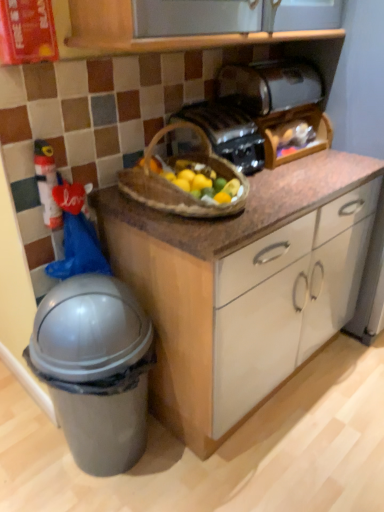
What do you see at coordinates (95, 369) in the screenshot?
I see `gray plastic trash can at lower left` at bounding box center [95, 369].

This screenshot has width=384, height=512. I want to click on gray plastic trash can at lower left, so click(x=95, y=369).

Locate an element on the screen. brown woven picnic basket at center is located at coordinates (176, 185).

Where is `gray plastic trash can at lower left`? This screenshot has width=384, height=512. gray plastic trash can at lower left is located at coordinates 95,369.

Is matte black toaster at center, the 2th toaster when ordered from top to bottom, closer to camera compared to gray plastic trash can at lower left?

Answer: No, matte black toaster at center, the 2th toaster when ordered from top to bottom, is further to the viewer.

From a real-world perspective, which object stands above the other?

matte black toaster at center, the 2th toaster when ordered from top to bottom, from a real-world perspective.

Considering the relative sizes of matte black toaster at center, the 2th toaster when ordered from top to bottom, and gray plastic trash can at lower left in the image provided, is matte black toaster at center, the 2th toaster when ordered from top to bottom, taller than gray plastic trash can at lower left?

No.

Is plastic fire extinguisher at left touching matte black toaster at center, the 1th toaster from the bottom?

No, plastic fire extinguisher at left is not making contact with matte black toaster at center, the 1th toaster from the bottom.

Relative to matte black toaster at center, the 2th toaster when ordered from top to bottom, is plastic fire extinguisher at left in front or behind?

Clearly, plastic fire extinguisher at left is in front of matte black toaster at center, the 2th toaster when ordered from top to bottom.

You are a GUI agent. You are given a task and a screenshot of the screen. Output one action in this format:
    pyautogui.click(x=<x>, y=<y>)
    Task: Click on the toy below the matte black toaster at center, the 2th toaster when ordered from top to bottom (from the image's perspective)
    The image size is (384, 512).
    Given the screenshot: What is the action you would take?
    pyautogui.click(x=47, y=183)

Is plastic fire extinguisher at left wider or thinner than matte black toaster at center, the 1th toaster from the bottom?

In the image, plastic fire extinguisher at left appears to be more narrow than matte black toaster at center, the 1th toaster from the bottom.

Can you confirm if satin black toaster at upper center, acting as the 2th toaster starting from the bottom, is taller than matte black toaster at center, the 2th toaster when ordered from top to bottom?

No.

Considering the sizes of objects satin black toaster at upper center, acting as the 2th toaster starting from the bottom, and matte black toaster at center, the 2th toaster when ordered from top to bottom, in the image provided, who is wider, satin black toaster at upper center, acting as the 2th toaster starting from the bottom, or matte black toaster at center, the 2th toaster when ordered from top to bottom,?

Wider between the two is matte black toaster at center, the 2th toaster when ordered from top to bottom.

In the image, is satin black toaster at upper center, marked as the first toaster in a top-to-bottom arrangement, positioned in front of or behind matte black toaster at center, the 2th toaster when ordered from top to bottom?

satin black toaster at upper center, marked as the first toaster in a top-to-bottom arrangement, is behind matte black toaster at center, the 2th toaster when ordered from top to bottom.

Considering the relative positions of satin black toaster at upper center, marked as the first toaster in a top-to-bottom arrangement, and matte black toaster at center, the 2th toaster when ordered from top to bottom, in the image provided, is satin black toaster at upper center, marked as the first toaster in a top-to-bottom arrangement, to the left of matte black toaster at center, the 2th toaster when ordered from top to bottom, from the viewer's perspective?

In fact, satin black toaster at upper center, marked as the first toaster in a top-to-bottom arrangement, is to the right of matte black toaster at center, the 2th toaster when ordered from top to bottom.

Is matte black toaster at center, the 2th toaster when ordered from top to bottom, taller than plastic fire extinguisher at left?

Incorrect, the height of matte black toaster at center, the 2th toaster when ordered from top to bottom, is not larger of that of plastic fire extinguisher at left.

Based on the photo, is matte black toaster at center, the 1th toaster from the bottom, touching plastic fire extinguisher at left?

There is a gap between matte black toaster at center, the 1th toaster from the bottom, and plastic fire extinguisher at left.

Is point (245, 143) in front of point (37, 165)?

No, (245, 143) is further to viewer.

Would you say matte black toaster at center, the 1th toaster from the bottom, is outside plastic fire extinguisher at left?

matte black toaster at center, the 1th toaster from the bottom, is positioned outside plastic fire extinguisher at left.

From a real-world perspective, does brown woven picnic basket at center sit lower than satin black toaster at upper center, acting as the 2th toaster starting from the bottom?

Indeed, from a real-world perspective, brown woven picnic basket at center is positioned beneath satin black toaster at upper center, acting as the 2th toaster starting from the bottom.

Locate an element on the screen. Image resolution: width=384 pixels, height=512 pixels. picnic basket in front of the satin black toaster at upper center, acting as the 2th toaster starting from the bottom is located at coordinates (176, 185).

Is point (151, 147) positioned before point (265, 80)?

Yes.

Can you see brown woven picnic basket at center touching satin black toaster at upper center, marked as the first toaster in a top-to-bottom arrangement?

No, brown woven picnic basket at center is not in contact with satin black toaster at upper center, marked as the first toaster in a top-to-bottom arrangement.

In the image, is brown woven picnic basket at center positioned in front of or behind matte black toaster at center, the 2th toaster when ordered from top to bottom?

brown woven picnic basket at center is positioned closer to the viewer than matte black toaster at center, the 2th toaster when ordered from top to bottom.

Is brown woven picnic basket at center situated inside matte black toaster at center, the 2th toaster when ordered from top to bottom, or outside?

brown woven picnic basket at center is outside matte black toaster at center, the 2th toaster when ordered from top to bottom.

Locate an element on the screen. This screenshot has height=512, width=384. the 1st toaster above the brown woven picnic basket at center (from the image's perspective) is located at coordinates (227, 132).

Considering the relative positions of brown woven picnic basket at center and matte black toaster at center, the 2th toaster when ordered from top to bottom, in the image provided, is brown woven picnic basket at center to the right of matte black toaster at center, the 2th toaster when ordered from top to bottom, from the viewer's perspective?

No.

From a real-world perspective, is gray plastic trash can at lower left positioned over matte black toaster at center, the 2th toaster when ordered from top to bottom, based on gravity?

No, from a real-world perspective, gray plastic trash can at lower left is not on top of matte black toaster at center, the 2th toaster when ordered from top to bottom.

Could you tell me if gray plastic trash can at lower left is facing matte black toaster at center, the 1th toaster from the bottom?

No, gray plastic trash can at lower left is not facing towards matte black toaster at center, the 1th toaster from the bottom.

Is gray plastic trash can at lower left bigger than matte black toaster at center, the 1th toaster from the bottom?

Indeed, gray plastic trash can at lower left has a larger size compared to matte black toaster at center, the 1th toaster from the bottom.

Does gray plastic trash can at lower left come in front of matte black toaster at center, the 2th toaster when ordered from top to bottom?

Yes, it is.

You are a GUI agent. You are given a task and a screenshot of the screen. Output one action in this format:
    pyautogui.click(x=<x>, y=<y>)
    Task: Click on the 1st toaster to the right of the gray plastic trash can at lower left, counting from the anchor's position
    The height and width of the screenshot is (512, 384).
    Given the screenshot: What is the action you would take?
    pyautogui.click(x=227, y=132)

The height and width of the screenshot is (512, 384). What are the coordinates of `toy lying below the matte black toaster at center, the 1th toaster from the bottom (from the image's perspective)` in the screenshot? It's located at (47, 183).

When comparing their distances from brown woven picnic basket at center, does plastic fire extinguisher at left or satin black toaster at upper center, acting as the 2th toaster starting from the bottom, seem further?

Among the two, satin black toaster at upper center, acting as the 2th toaster starting from the bottom, is located further to brown woven picnic basket at center.

In the scene shown: Considering their positions, is gray plastic trash can at lower left positioned closer to brown woven picnic basket at center than matte black toaster at center, the 2th toaster when ordered from top to bottom?

Among the two, matte black toaster at center, the 2th toaster when ordered from top to bottom, is located nearer to brown woven picnic basket at center.

When comparing their distances from gray plastic trash can at lower left, does matte black toaster at center, the 2th toaster when ordered from top to bottom, or plastic fire extinguisher at left seem further?

Based on the image, matte black toaster at center, the 2th toaster when ordered from top to bottom, appears to be further to gray plastic trash can at lower left.

When comparing their distances from satin black toaster at upper center, marked as the first toaster in a top-to-bottom arrangement, does gray plastic trash can at lower left or matte black toaster at center, the 2th toaster when ordered from top to bottom, seem further?

Based on the image, gray plastic trash can at lower left appears to be further to satin black toaster at upper center, marked as the first toaster in a top-to-bottom arrangement.

Based on their spatial positions, is brown woven picnic basket at center or gray plastic trash can at lower left closer to plastic fire extinguisher at left?

brown woven picnic basket at center lies closer to plastic fire extinguisher at left than the other object.

Based on their spatial positions, is plastic fire extinguisher at left or gray plastic trash can at lower left closer to satin black toaster at upper center, acting as the 2th toaster starting from the bottom?

plastic fire extinguisher at left.

When comparing their distances from gray plastic trash can at lower left, does satin black toaster at upper center, acting as the 2th toaster starting from the bottom, or brown woven picnic basket at center seem further?

satin black toaster at upper center, acting as the 2th toaster starting from the bottom, is further to gray plastic trash can at lower left.

When comparing their distances from gray plastic trash can at lower left, does brown woven picnic basket at center or matte black toaster at center, the 2th toaster when ordered from top to bottom, seem closer?

brown woven picnic basket at center.

Locate an element on the screen. The width and height of the screenshot is (384, 512). toaster between plastic fire extinguisher at left and satin black toaster at upper center, marked as the first toaster in a top-to-bottom arrangement is located at coordinates (227, 132).

Identify the location of picnic basket between matte black toaster at center, the 1th toaster from the bottom, and gray plastic trash can at lower left in the up-down direction. This screenshot has width=384, height=512. (176, 185).

Locate an element on the screen. toy that lies between brown woven picnic basket at center and gray plastic trash can at lower left from top to bottom is located at coordinates (47, 183).

I want to click on toy between satin black toaster at upper center, acting as the 2th toaster starting from the bottom, and gray plastic trash can at lower left from top to bottom, so click(47, 183).